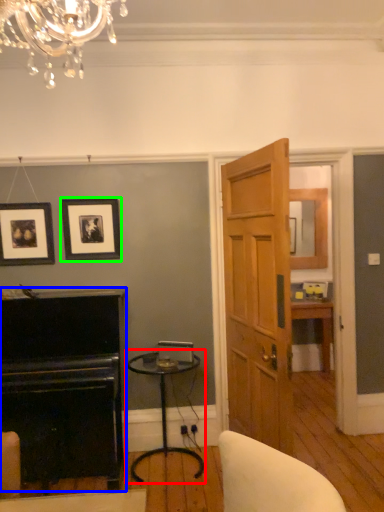
Question: Which is nearer to the table (highlighted by a red box)? fireplace (highlighted by a blue box) or picture frame (highlighted by a green box).

Choices:
 (A) fireplace
 (B) picture frame

Answer: (A)